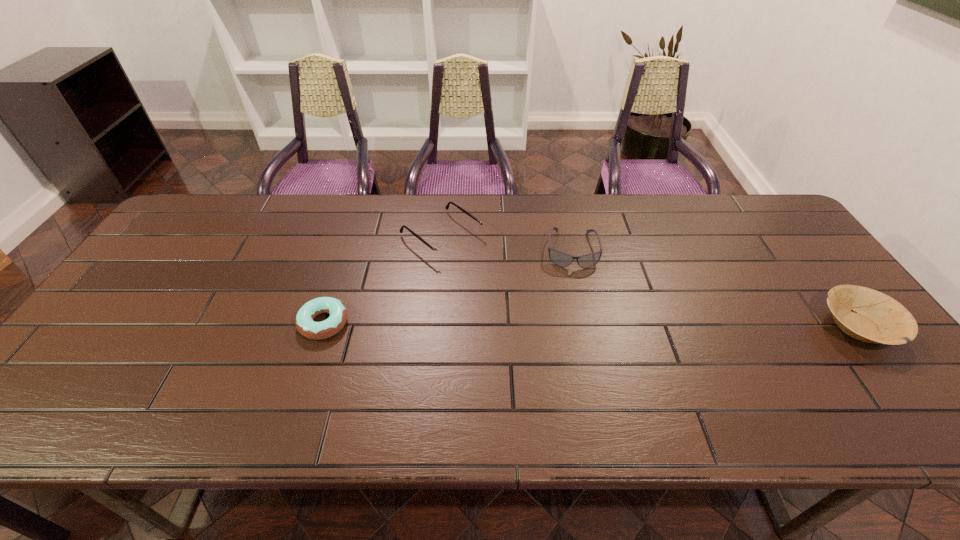
At what (x,y) coordinates should I click in order to perform the action: click on free space on the desktop that is between the doughnut and the bowl and is positioned at the hinge ends of the second object from left to right. Please return your answer as a coordinate pair (x, y). Image resolution: width=960 pixels, height=540 pixels. Looking at the image, I should click on (558, 325).

Identify the location of free space on the desktop that is between the shortest object and the bowl and is positioned on the lenses of the third object from left to right. (577, 325).